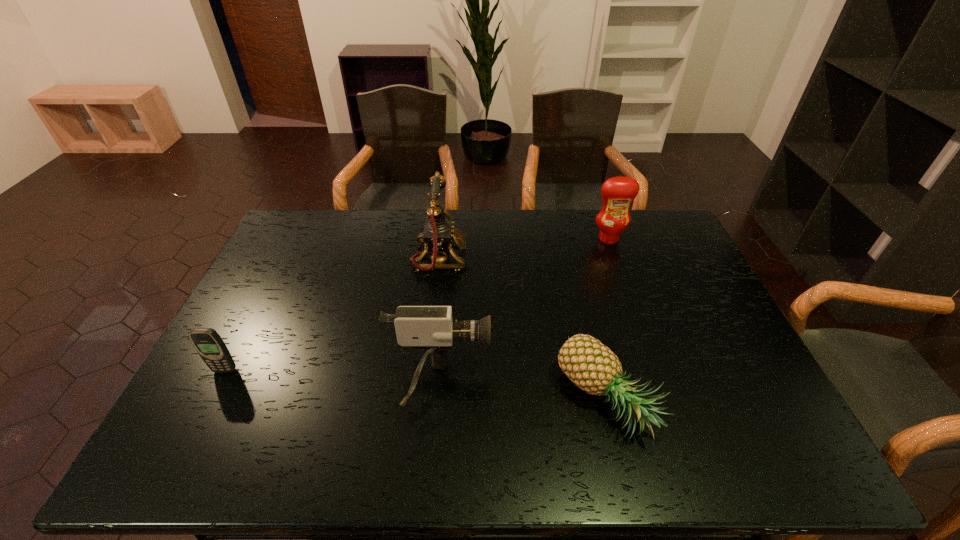
Identify the location of telephone that is at the far edge. The height and width of the screenshot is (540, 960). (438, 234).

Image resolution: width=960 pixels, height=540 pixels. In order to click on condiment situated at the far edge in this screenshot , I will do `click(618, 193)`.

Find the location of a particular element. object present at the near edge is located at coordinates (593, 367).

Identify the location of object located in the left edge section of the desktop. (207, 342).

Image resolution: width=960 pixels, height=540 pixels. Identify the location of free space at the far edge of the desktop. (424, 215).

Identify the location of vacant space at the near edge of the desktop. Image resolution: width=960 pixels, height=540 pixels. 720,457.

In the image, there is a desktop. What are the coordinates of `blank space at the left edge` in the screenshot? It's located at (276, 290).

In the image, there is a desktop. Where is `vacant space at the right edge`? vacant space at the right edge is located at coordinates (718, 322).

Image resolution: width=960 pixels, height=540 pixels. What are the coordinates of `vacant area at the far left corner` in the screenshot? It's located at (291, 226).

Image resolution: width=960 pixels, height=540 pixels. Identify the location of vacant space at the far right corner. pyautogui.click(x=673, y=240).